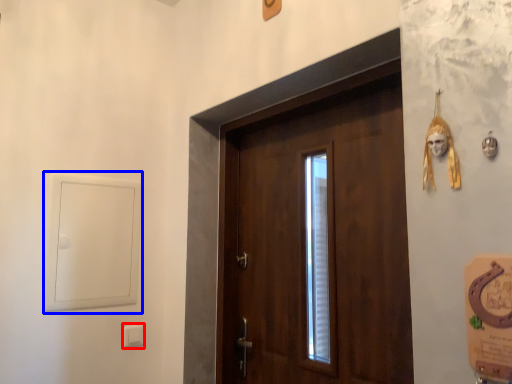
Question: Among these objects, which one is farthest to the camera, light switch (highlighted by a red box) or window (highlighted by a blue box)?

Choices:
 (A) light switch
 (B) window

Answer: (A)